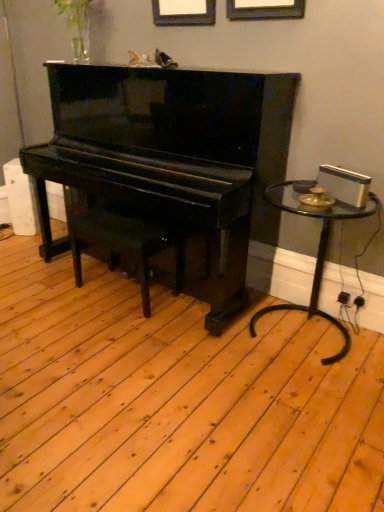
Question: Is black polished wood music stool at center far away from transparent glass table at right?

Choices:
 (A) yes
 (B) no

Answer: (B)

Question: Is black polished wood music stool at center to the right of transparent glass table at right from the viewer's perspective?

Choices:
 (A) yes
 (B) no

Answer: (B)

Question: Is black polished wood music stool at center positioned in front of transparent glass table at right?

Choices:
 (A) no
 (B) yes

Answer: (A)

Question: Is black polished wood music stool at center taller than transparent glass table at right?

Choices:
 (A) no
 (B) yes

Answer: (A)

Question: Is black polished wood music stool at center oriented towards transparent glass table at right?

Choices:
 (A) yes
 (B) no

Answer: (B)

Question: From a real-world perspective, is black polished wood music stool at center positioned above or below transparent glass table at right?

Choices:
 (A) below
 (B) above

Answer: (A)

Question: In terms of height, does black polished wood music stool at center look taller or shorter compared to transparent glass table at right?

Choices:
 (A) short
 (B) tall

Answer: (A)

Question: Relative to transparent glass table at right, is black polished wood music stool at center in front or behind?

Choices:
 (A) behind
 (B) front

Answer: (A)

Question: Considering the positions of point (148, 236) and point (339, 357), is point (148, 236) closer or farther from the camera than point (339, 357)?

Choices:
 (A) closer
 (B) farther

Answer: (B)

Question: Is glossy black piano at center taller or shorter than transparent glass table at right?

Choices:
 (A) short
 (B) tall

Answer: (B)

Question: Is glossy black piano at center wider or thinner than transparent glass table at right?

Choices:
 (A) thin
 (B) wide

Answer: (B)

Question: Based on their positions, is glossy black piano at center located to the left or right of transparent glass table at right?

Choices:
 (A) left
 (B) right

Answer: (A)

Question: Is point (205, 183) closer or farther from the camera than point (278, 186)?

Choices:
 (A) closer
 (B) farther

Answer: (A)

Question: Considering the positions of point (69, 208) and point (145, 175), is point (69, 208) closer or farther from the camera than point (145, 175)?

Choices:
 (A) farther
 (B) closer

Answer: (A)

Question: From a real-world perspective, is black polished wood music stool at center physically located above or below glossy black piano at center?

Choices:
 (A) below
 (B) above

Answer: (A)